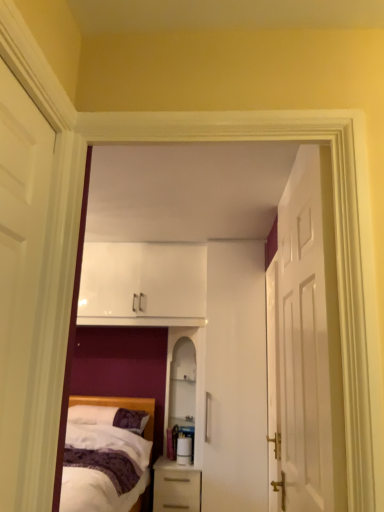
Question: Considering the relative sizes of white glossy door at right, the 3th door when ordered from left to right, and white matte door at left, positioned as the 1th door in left-to-right order, in the image provided, is white glossy door at right, the 3th door when ordered from left to right, shorter than white matte door at left, positioned as the 1th door in left-to-right order,?

Choices:
 (A) no
 (B) yes

Answer: (A)

Question: From a real-world perspective, is white glossy door at right, the 3th door when ordered from left to right, physically below white matte door at left, positioned as the 1th door in left-to-right order?

Choices:
 (A) no
 (B) yes

Answer: (B)

Question: Does white glossy door at right, arranged as the 1th door when viewed from the right, have a greater width compared to white matte door at left, which ranks as the 3th door in right-to-left order?

Choices:
 (A) yes
 (B) no

Answer: (A)

Question: Can you confirm if white glossy door at right, the 3th door when ordered from left to right, is positioned to the left of white matte door at left, positioned as the 1th door in left-to-right order?

Choices:
 (A) yes
 (B) no

Answer: (B)

Question: Is white glossy door at right, the 3th door when ordered from left to right, facing away from white matte door at left, positioned as the 1th door in left-to-right order?

Choices:
 (A) no
 (B) yes

Answer: (A)

Question: From a real-world perspective, is purple soft pillow at lower left physically located above or below white glossy door at right, the 3th door when ordered from left to right?

Choices:
 (A) below
 (B) above

Answer: (A)

Question: In the image, is purple soft pillow at lower left positioned in front of or behind white glossy door at right, arranged as the 1th door when viewed from the right?

Choices:
 (A) behind
 (B) front

Answer: (A)

Question: In terms of height, does purple soft pillow at lower left look taller or shorter compared to white glossy door at right, arranged as the 1th door when viewed from the right?

Choices:
 (A) tall
 (B) short

Answer: (B)

Question: Does point (100, 418) appear closer or farther from the camera than point (269, 485)?

Choices:
 (A) farther
 (B) closer

Answer: (A)

Question: Is white glossy cabinet at center inside the boundaries of white glossy door at right, the 3th door when ordered from left to right, or outside?

Choices:
 (A) outside
 (B) inside

Answer: (A)

Question: From their relative heights in the image, would you say white glossy cabinet at center is taller or shorter than white glossy door at right, arranged as the 1th door when viewed from the right?

Choices:
 (A) tall
 (B) short

Answer: (B)

Question: Is point (187, 485) positioned closer to the camera than point (271, 392)?

Choices:
 (A) closer
 (B) farther

Answer: (B)

Question: From a real-world perspective, is white glossy cabinet at center physically located above or below white glossy door at right, arranged as the 1th door when viewed from the right?

Choices:
 (A) above
 (B) below

Answer: (B)

Question: Considering the relative positions of white wooden door at right, which is counted as the second door, starting from the left, and white matte door at left, positioned as the 1th door in left-to-right order, in the image provided, is white wooden door at right, which is counted as the second door, starting from the left, to the left or to the right of white matte door at left, positioned as the 1th door in left-to-right order,?

Choices:
 (A) left
 (B) right

Answer: (B)

Question: Looking at their shapes, would you say white wooden door at right, marked as the 2th door in a right-to-left arrangement, is wider or thinner than white matte door at left, which ranks as the 3th door in right-to-left order?

Choices:
 (A) wide
 (B) thin

Answer: (A)